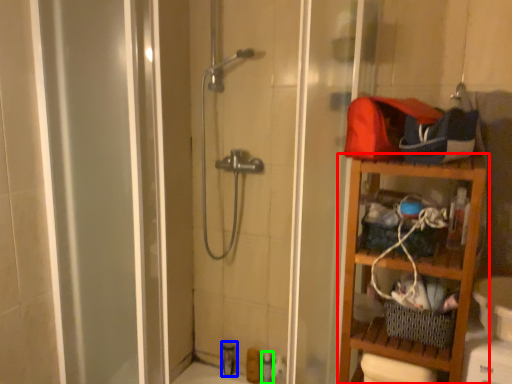
Question: Estimate the real-world distances between objects in this image. Which object is farther from shelf (highlighted by a red box), toiletry (highlighted by a blue box) or toiletry (highlighted by a green box)?

Choices:
 (A) toiletry
 (B) toiletry

Answer: (A)